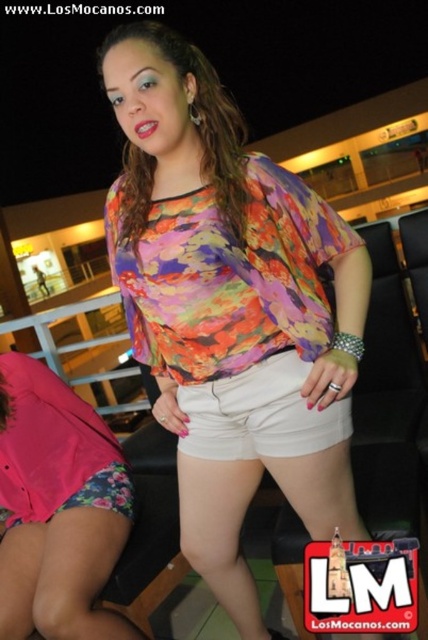
Which is below, pink floral shorts at lower left or white cotton shorts at center?

pink floral shorts at lower left is below.

Who is taller, pink floral shorts at lower left or white cotton shorts at center?

pink floral shorts at lower left is taller.

Where is `pink floral shorts at lower left`? This screenshot has width=428, height=640. pink floral shorts at lower left is located at coordinates (56, 508).

Locate an element on the screen. The image size is (428, 640). pink floral shorts at lower left is located at coordinates (56, 508).

Does floral print blouse at center have a larger size compared to white cotton shorts at center?

Correct, floral print blouse at center is larger in size than white cotton shorts at center.

Does floral print blouse at center come in front of white cotton shorts at center?

Yes.

You are a GUI agent. You are given a task and a screenshot of the screen. Output one action in this format:
    pyautogui.click(x=<x>, y=<y>)
    Task: Click on the floral print blouse at center
    Image resolution: width=428 pixels, height=640 pixels.
    Given the screenshot: What is the action you would take?
    pyautogui.click(x=229, y=305)

Can you confirm if pink floral shorts at lower left is bigger than multicolored fabric blouse at center?

Yes, pink floral shorts at lower left is bigger than multicolored fabric blouse at center.

Between point (71, 445) and point (139, 196), which one is positioned behind?

The point (71, 445) is behind.

Describe the element at coordinates (56, 508) in the screenshot. This screenshot has width=428, height=640. I see `pink floral shorts at lower left` at that location.

The height and width of the screenshot is (640, 428). Find the location of `pink floral shorts at lower left`. pink floral shorts at lower left is located at coordinates (56, 508).